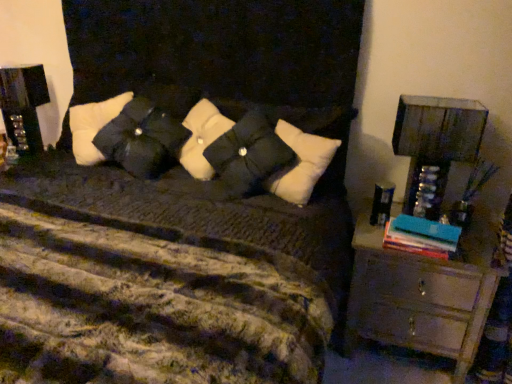
Question: Is wooden chest of drawers at right further to camera compared to black glossy speaker at left?

Choices:
 (A) no
 (B) yes

Answer: (A)

Question: Is wooden chest of drawers at right positioned in front of black glossy speaker at left?

Choices:
 (A) no
 (B) yes

Answer: (B)

Question: From the image's perspective, is wooden chest of drawers at right located beneath black glossy speaker at left?

Choices:
 (A) yes
 (B) no

Answer: (A)

Question: Does wooden chest of drawers at right have a lesser height compared to black glossy speaker at left?

Choices:
 (A) yes
 (B) no

Answer: (B)

Question: Considering the relative sizes of wooden chest of drawers at right and black glossy speaker at left in the image provided, is wooden chest of drawers at right thinner than black glossy speaker at left?

Choices:
 (A) yes
 (B) no

Answer: (B)

Question: From a real-world perspective, is wooden chest of drawers at right positioned under black glossy speaker at left based on gravity?

Choices:
 (A) no
 (B) yes

Answer: (B)

Question: Are teal matte book at right and black matte pillow at center far apart?

Choices:
 (A) yes
 (B) no

Answer: (B)

Question: Does teal matte book at right have a lesser width compared to black matte pillow at center?

Choices:
 (A) no
 (B) yes

Answer: (B)

Question: Does teal matte book at right appear on the left side of black matte pillow at center?

Choices:
 (A) yes
 (B) no

Answer: (B)

Question: Is teal matte book at right to the right of black matte pillow at center from the viewer's perspective?

Choices:
 (A) yes
 (B) no

Answer: (A)

Question: Is teal matte book at right further to camera compared to black matte pillow at center?

Choices:
 (A) yes
 (B) no

Answer: (B)

Question: Considering the relative sizes of teal matte book at right and black matte pillow at center in the image provided, is teal matte book at right smaller than black matte pillow at center?

Choices:
 (A) no
 (B) yes

Answer: (B)

Question: Does teal matte book at right have a lesser height compared to black glossy speaker at left?

Choices:
 (A) yes
 (B) no

Answer: (A)